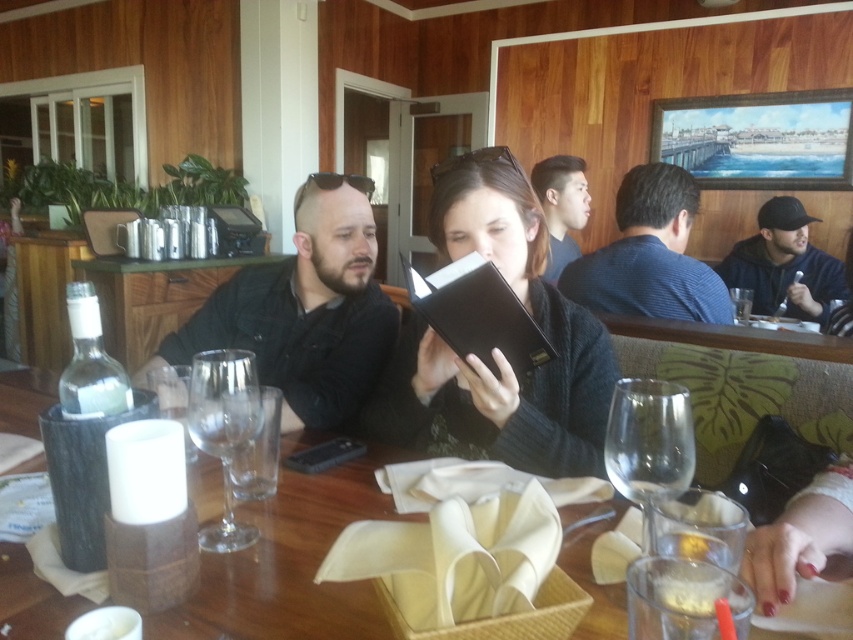
Does dark gray flannel shirt at center appear under dark blue hoodie at right?

Yes, dark gray flannel shirt at center is below dark blue hoodie at right.

Can you confirm if dark gray flannel shirt at center is wider than dark blue hoodie at right?

Yes.

Is point (372, 369) behind point (747, 241)?

That is False.

Image resolution: width=853 pixels, height=640 pixels. Identify the location of dark gray flannel shirt at center. (305, 310).

Does clear glass at left lie behind transparent glass wine glass at center?

Yes, clear glass at left is behind transparent glass wine glass at center.

From the picture: Is clear glass at left taller than transparent glass wine glass at center?

Yes.

Describe the element at coordinates (152, 298) in the screenshot. I see `clear glass at left` at that location.

The image size is (853, 640). I want to click on clear glass at left, so click(x=152, y=298).

Who is shorter, dark gray flannel shirt at center or smooth black hair at upper center?

Standing shorter between the two is dark gray flannel shirt at center.

Who is higher up, dark gray flannel shirt at center or smooth black hair at upper center?

smooth black hair at upper center is higher up.

Is point (349, 193) farther from viewer compared to point (573, 189)?

No, (349, 193) is in front of (573, 189).

Identify the location of dark gray flannel shirt at center. The height and width of the screenshot is (640, 853). (305, 310).